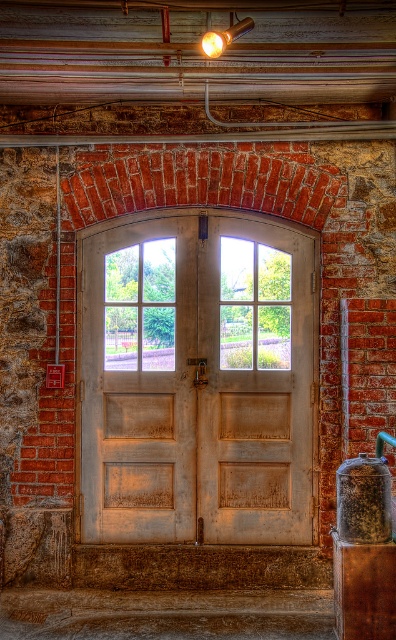
Who is shorter, white wood door at center or brown textured pillar at lower right?

brown textured pillar at lower right

How far apart are white wood door at center and brown textured pillar at lower right?

A distance of 4.62 feet exists between white wood door at center and brown textured pillar at lower right.

What do you see at coordinates (198, 380) in the screenshot?
I see `white wood door at center` at bounding box center [198, 380].

The width and height of the screenshot is (396, 640). What are the coordinates of `white wood door at center` in the screenshot? It's located at (198, 380).

Can you confirm if clear glass window at center is positioned to the right of brown textured pillar at lower right?

In fact, clear glass window at center is to the left of brown textured pillar at lower right.

Locate an element on the screen. The width and height of the screenshot is (396, 640). clear glass window at center is located at coordinates (140, 307).

Find the location of a particular element. The image size is (396, 640). clear glass window at center is located at coordinates coord(140,307).

Is clear glass window at center smaller than matte gold light fixture at upper center?

Actually, clear glass window at center might be larger than matte gold light fixture at upper center.

Which of these two, clear glass window at center or matte gold light fixture at upper center, stands shorter?

matte gold light fixture at upper center

Locate an element on the screen. The height and width of the screenshot is (640, 396). clear glass window at center is located at coordinates (140, 307).